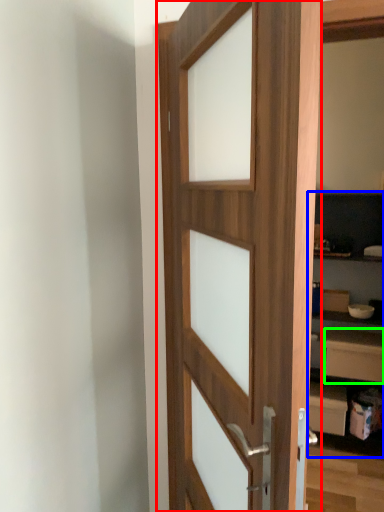
Question: Considering the real-world distances, which object is closest to door (highlighted by a red box)? bookshelf (highlighted by a blue box) or drawer (highlighted by a green box).

Choices:
 (A) bookshelf
 (B) drawer

Answer: (A)